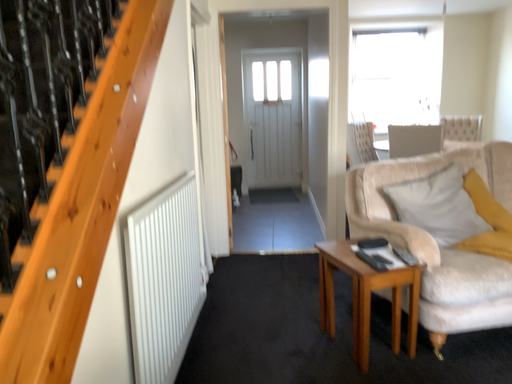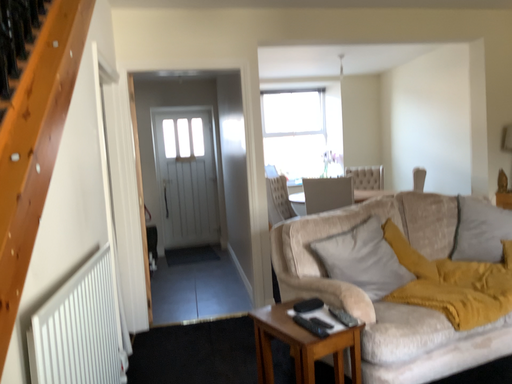
Question: How did the camera likely rotate when shooting the video?

Choices:
 (A) rotated downward
 (B) rotated upward

Answer: (B)